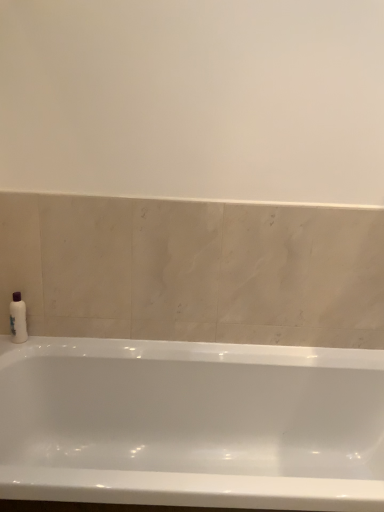
The width and height of the screenshot is (384, 512). Describe the element at coordinates (18, 318) in the screenshot. I see `white plastic bottle at left` at that location.

This screenshot has width=384, height=512. Find the location of `white plastic bottle at left`. white plastic bottle at left is located at coordinates (18, 318).

The width and height of the screenshot is (384, 512). Describe the element at coordinates (191, 424) in the screenshot. I see `white glossy bathtub at lower center` at that location.

Where is `white glossy bathtub at lower center`? white glossy bathtub at lower center is located at coordinates (191, 424).

Where is `white plastic bottle at left`? Image resolution: width=384 pixels, height=512 pixels. white plastic bottle at left is located at coordinates coord(18,318).

Does white plastic bottle at left appear on the left side of white glossy bathtub at lower center?

Indeed, white plastic bottle at left is positioned on the left side of white glossy bathtub at lower center.

Relative to white glossy bathtub at lower center, is white plastic bottle at left in front or behind?

Visually, white plastic bottle at left is located behind white glossy bathtub at lower center.

Which is behind, point (22, 314) or point (336, 437)?

The point (336, 437) is farther from the camera.

From the image's perspective, which is above, white plastic bottle at left or white glossy bathtub at lower center?

white plastic bottle at left, from the image's perspective.

From a real-world perspective, is white plastic bottle at left over white glossy bathtub at lower center?

Yes.

Considering the relative sizes of white plastic bottle at left and white glossy bathtub at lower center in the image provided, is white plastic bottle at left wider than white glossy bathtub at lower center?

No.

Who is shorter, white plastic bottle at left or white glossy bathtub at lower center?

With less height is white plastic bottle at left.

Can you confirm if white plastic bottle at left is bigger than white glossy bathtub at lower center?

No, white plastic bottle at left is not bigger than white glossy bathtub at lower center.

Can we say white plastic bottle at left lies outside white glossy bathtub at lower center?

Yes, white plastic bottle at left is located beyond the bounds of white glossy bathtub at lower center.

Based on the photo, would you say white plastic bottle at left is a long distance from white glossy bathtub at lower center?

No, there isn't a large distance between white plastic bottle at left and white glossy bathtub at lower center.

Is white plastic bottle at left looking in the opposite direction of white glossy bathtub at lower center?

No, white glossy bathtub at lower center is not at the back of white plastic bottle at left.

Based on the photo, how different are the orientations of white plastic bottle at left and white glossy bathtub at lower center in degrees?

They differ by 4.19 degrees in their facing directions.

Measure the distance from white plastic bottle at left to white glossy bathtub at lower center.

A distance of 24.65 inches exists between white plastic bottle at left and white glossy bathtub at lower center.

Where is `soap dispenser above the white glossy bathtub at lower center (from a real-world perspective)`? The height and width of the screenshot is (512, 384). soap dispenser above the white glossy bathtub at lower center (from a real-world perspective) is located at coordinates (18, 318).

Looking at this image, considering the positions of objects white glossy bathtub at lower center and white plastic bottle at left in the image provided, who is more to the left, white glossy bathtub at lower center or white plastic bottle at left?

white plastic bottle at left.

Which object is closer to the camera taking this photo, white glossy bathtub at lower center or white plastic bottle at left?

Positioned in front is white glossy bathtub at lower center.

Is point (253, 366) farther from camera compared to point (10, 307)?

That is False.

Looking at this image, from the image's perspective, which is above, white glossy bathtub at lower center or white plastic bottle at left?

white plastic bottle at left appears higher in the image.

From a real-world perspective, who is located lower, white glossy bathtub at lower center or white plastic bottle at left?

white glossy bathtub at lower center, from a real-world perspective.

From the picture: Between white glossy bathtub at lower center and white plastic bottle at left, which one has smaller width?

Thinner between the two is white plastic bottle at left.

Considering the relative sizes of white glossy bathtub at lower center and white plastic bottle at left in the image provided, is white glossy bathtub at lower center taller than white plastic bottle at left?

Yes, white glossy bathtub at lower center is taller than white plastic bottle at left.

Looking at the image, does white glossy bathtub at lower center seem bigger or smaller compared to white plastic bottle at left?

white glossy bathtub at lower center is bigger than white plastic bottle at left.

Choose the correct answer: Is white glossy bathtub at lower center inside white plastic bottle at left or outside it?

The correct answer is: outside.

Are white glossy bathtub at lower center and white plastic bottle at left located far from each other?

They are positioned close to each other.

Is white glossy bathtub at lower center facing towards white plastic bottle at left?

No, white glossy bathtub at lower center does not turn towards white plastic bottle at left.

What's the angular difference between white glossy bathtub at lower center and white plastic bottle at left's facing directions?

white glossy bathtub at lower center and white plastic bottle at left are facing 4.19 degrees away from each other.

Find the location of `soap dispenser above the white glossy bathtub at lower center (from a real-world perspective)`. soap dispenser above the white glossy bathtub at lower center (from a real-world perspective) is located at coordinates (18, 318).

I want to click on bathtub in front of the white plastic bottle at left, so coord(191,424).

Find the location of a particular element. The width and height of the screenshot is (384, 512). soap dispenser lying behind the white glossy bathtub at lower center is located at coordinates (18, 318).